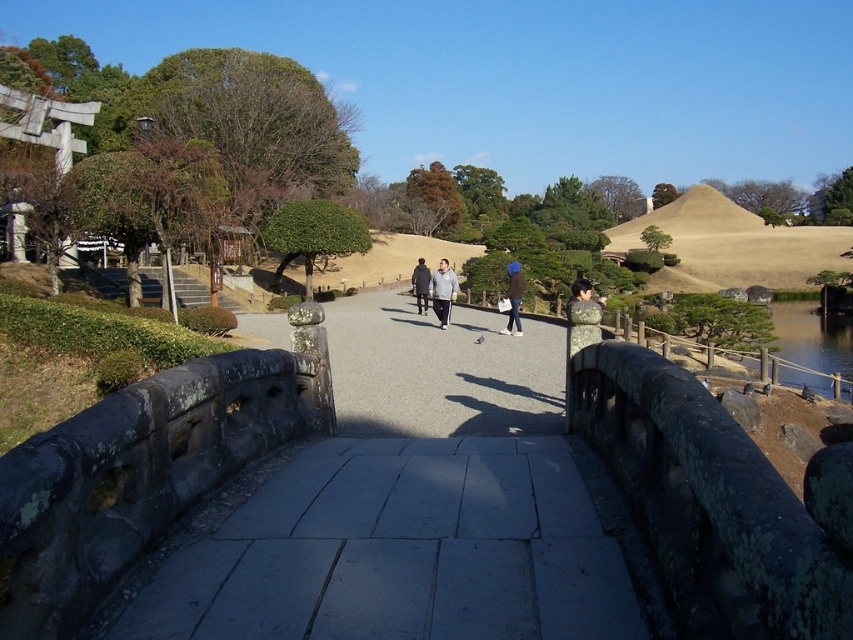
You are standing at the stone bridge and want to place your blue fabric bag at center on the ground. Considering the bridge has a width of 1.2 meters, is the bag within the bridge area?

The blue fabric bag at center is located at point (x=514, y=298). Since the bridge spans from 0 to 1 in the x and y coordinates, the bag is within the bridge area and can be safely placed there.

You are a photographer standing on the stone bridge and want to capture both the gray fabric jacket at center and the dark gray stone figure at center in a single frame. Which object should you focus on first to ensure both are in the frame?

You should focus on the dark gray stone figure at center first because it is larger than the gray fabric jacket at center, allowing you to frame it properly while ensuring the smaller jacket fits within the shot.

From the picture: You are a park visitor who wants to place your blue fabric bag at center on top of the dark gray stone figure at center. Is this possible based on their sizes?

The blue fabric bag at center is much taller than the dark gray stone figure at center, so placing it on top would not be possible due to the bag being larger in height.